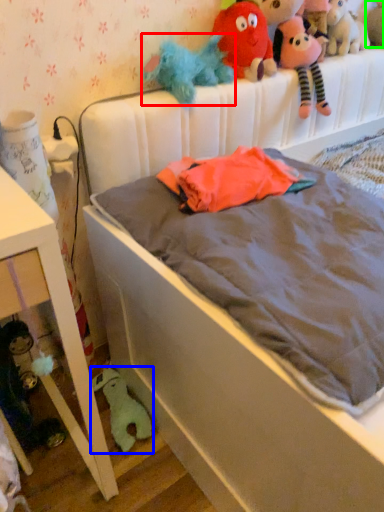
Question: Estimate the real-world distances between objects in this image. Which object is farther from toy (highlighted by a red box), toy (highlighted by a blue box) or toy (highlighted by a green box)?

Choices:
 (A) toy
 (B) toy

Answer: (A)